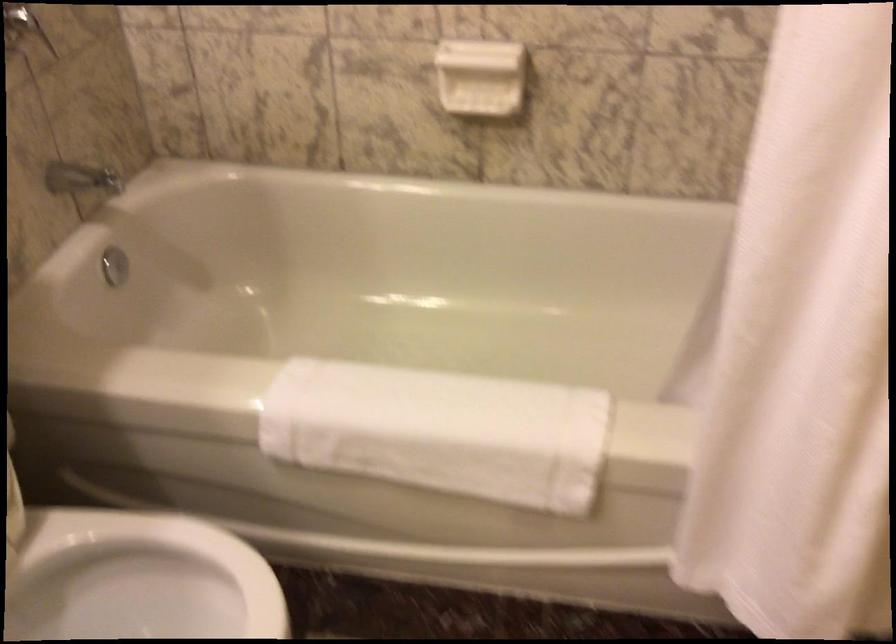
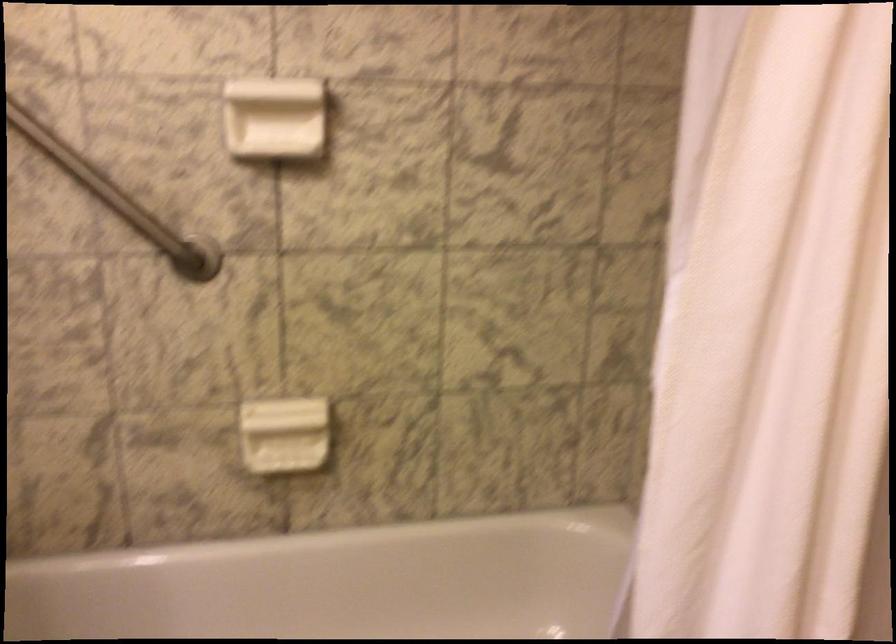
Based on the continuous images, in which direction is the camera rotating?

The camera's rotation is toward right-up.